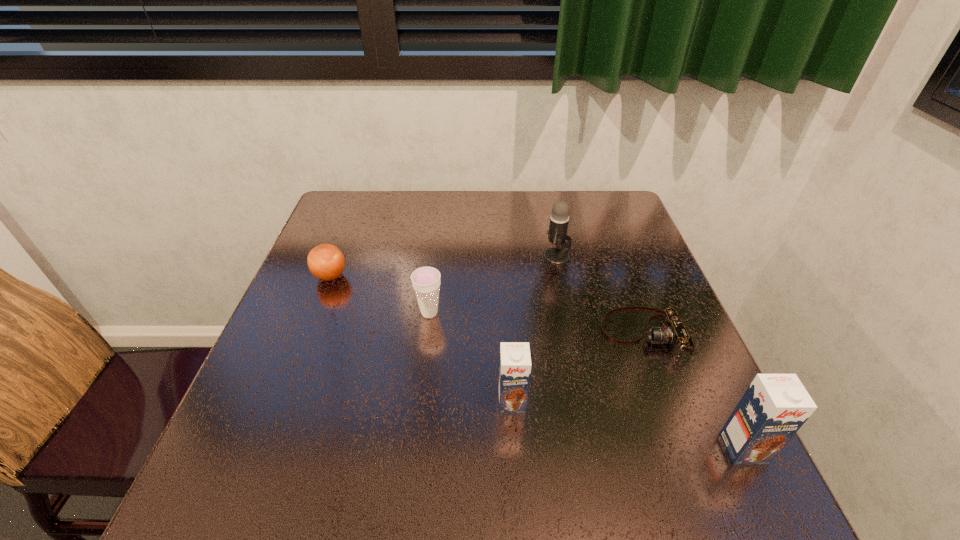
Locate an element on the screen. The width and height of the screenshot is (960, 540). object situated at the near right corner is located at coordinates (774, 407).

At what (x,y) coordinates should I click in order to perform the action: click on blank space at the far edge of the desktop. Please return your answer as a coordinate pair (x, y). The image size is (960, 540). Looking at the image, I should click on (462, 225).

In the image, there is a desktop. Identify the location of vacant space at the left edge. (349, 243).

Locate an element on the screen. This screenshot has width=960, height=540. blank area at the right edge is located at coordinates (585, 235).

At what (x,y) coordinates should I click in order to perform the action: click on blank area at the far left corner. Please return your answer as a coordinate pair (x, y). This screenshot has width=960, height=540. Looking at the image, I should click on (379, 201).

In the image, there is a desktop. Find the location of `vacant space at the near left corner`. vacant space at the near left corner is located at coordinates (233, 433).

The width and height of the screenshot is (960, 540). Identify the location of vacant area at the far right corner. (620, 192).

The image size is (960, 540). In the image, there is a desktop. Identify the location of vacant space at the near right corner. (709, 430).

Locate an element on the screen. free space between the right chocolate milk and the fourth object from left to right is located at coordinates (650, 353).

Locate an element on the screen. The image size is (960, 540). vacant space that is in between the orange and the third object from left to right is located at coordinates (421, 339).